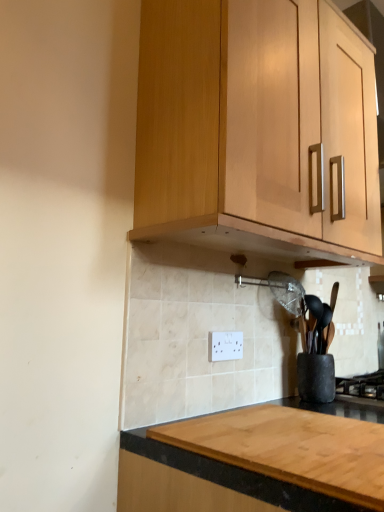
Question: From the image's perspective, is white plastic electric outlet at center over black matte gas stove at lower right?

Choices:
 (A) yes
 (B) no

Answer: (A)

Question: Is white plastic electric outlet at center in front of black matte gas stove at lower right?

Choices:
 (A) no
 (B) yes

Answer: (B)

Question: Is white plastic electric outlet at center oriented away from black matte gas stove at lower right?

Choices:
 (A) no
 (B) yes

Answer: (A)

Question: Considering the relative positions of white plastic electric outlet at center and black matte gas stove at lower right in the image provided, is white plastic electric outlet at center to the right of black matte gas stove at lower right from the viewer's perspective?

Choices:
 (A) yes
 (B) no

Answer: (B)

Question: Is white plastic electric outlet at center positioned behind black matte gas stove at lower right?

Choices:
 (A) no
 (B) yes

Answer: (A)

Question: Based on their positions, is white plastic electric outlet at center located to the left or right of light wood cabinet at upper center?

Choices:
 (A) left
 (B) right

Answer: (A)

Question: Looking at their shapes, would you say white plastic electric outlet at center is wider or thinner than light wood cabinet at upper center?

Choices:
 (A) thin
 (B) wide

Answer: (A)

Question: Does point (216, 332) appear closer or farther from the camera than point (269, 29)?

Choices:
 (A) farther
 (B) closer

Answer: (A)

Question: In the image, is white plastic electric outlet at center positioned in front of or behind light wood cabinet at upper center?

Choices:
 (A) behind
 (B) front

Answer: (A)

Question: Would you say light wood cabinet at upper center is to the left or to the right of black matte gas stove at lower right in the picture?

Choices:
 (A) left
 (B) right

Answer: (A)

Question: Is light wood cabinet at upper center taller or shorter than black matte gas stove at lower right?

Choices:
 (A) tall
 (B) short

Answer: (A)

Question: Based on their sizes in the image, would you say light wood cabinet at upper center is bigger or smaller than black matte gas stove at lower right?

Choices:
 (A) big
 (B) small

Answer: (A)

Question: From a real-world perspective, is light wood cabinet at upper center above or below black matte gas stove at lower right?

Choices:
 (A) above
 (B) below

Answer: (A)

Question: From the image's perspective, is white plastic electric outlet at center above or below black matte gas stove at lower right?

Choices:
 (A) above
 (B) below

Answer: (A)

Question: In terms of size, does white plastic electric outlet at center appear bigger or smaller than black matte gas stove at lower right?

Choices:
 (A) big
 (B) small

Answer: (B)